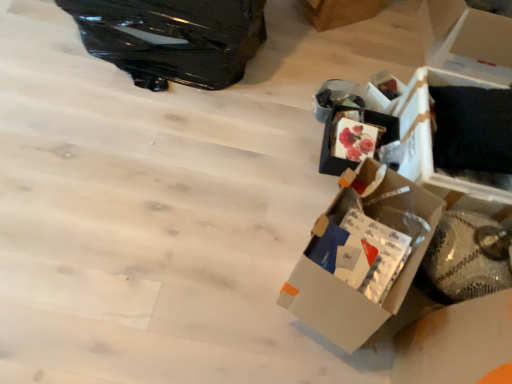
Locate an element on the screen. free space to the back side of white cardboard box at center-right is located at coordinates (297, 178).